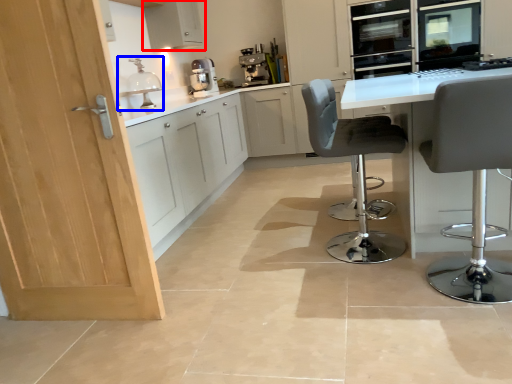
Question: Which point is further to the camera, cabinetry (highlighted by a red box) or sink (highlighted by a blue box)?

Choices:
 (A) cabinetry
 (B) sink

Answer: (A)